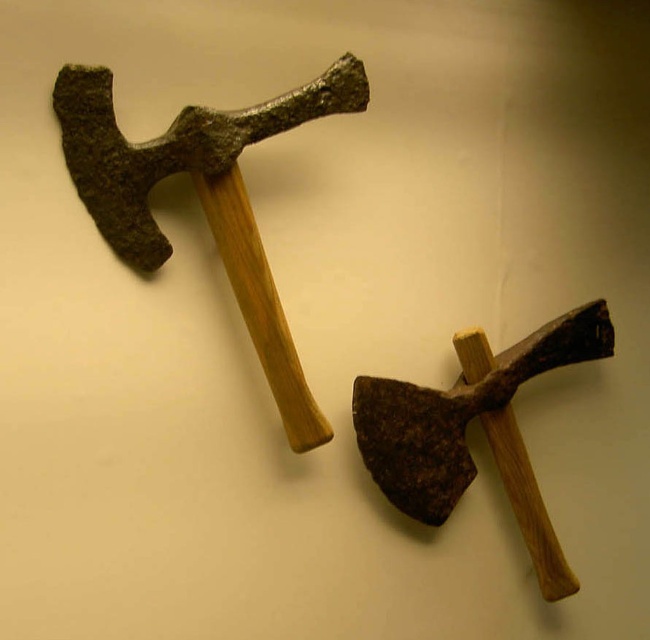
You are an archaeologist examining two ancient axes displayed in a museum. The axes are positioned at point (202, 198). Which object is located at that coordinate?

The rusty metal hammer at upper left is located at point (202, 198).

You are an archaeologist examining two rusty metal hammers in the image. Which one is positioned closer to you, the rusty metal hammer at upper left or the rusty metal hammer at center?

The rusty metal hammer at upper left is closer to the viewer than the rusty metal hammer at center.